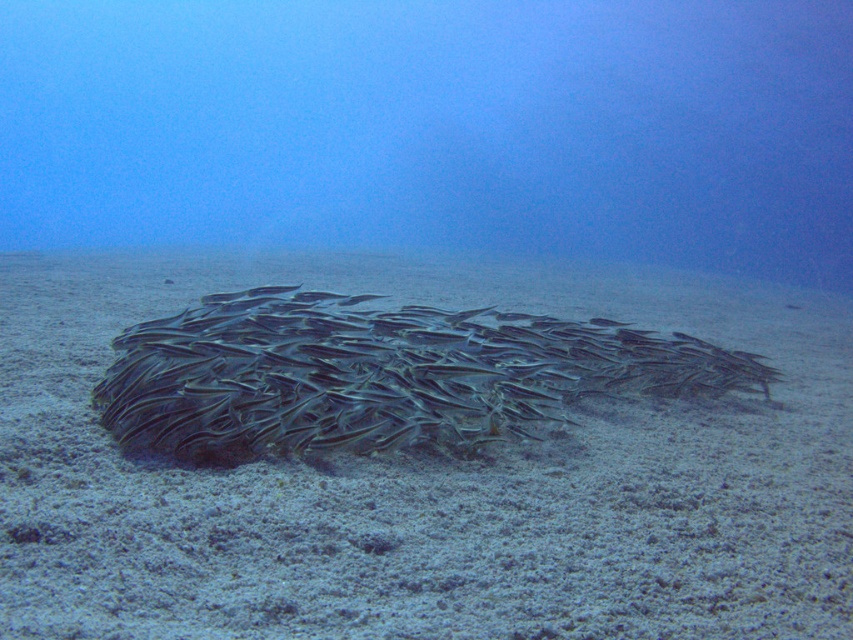
You are a marine biologist observing an underwater scene. You notice the gray sandy bottom at center and the silvery metallic fish at center. How far apart are these two objects from each other?

The gray sandy bottom at center is 4.58 feet away from the silvery metallic fish at center.

Consider the image. You are a diver exploring this underwater scene. You notice two points marked in the image. From your vantage point, which point is closer to you, point (660, 460) or point (267, 417)?

Point (660, 460) is further to the viewer than point (267, 417), so point (267, 417) is closer to you.

You are a scuba diver observing the underwater scene. You see the gray sandy bottom at center and the silvery metallic fish at center. Which object is located to the right side?

The silvery metallic fish at center is located to the right side of the gray sandy bottom at center.